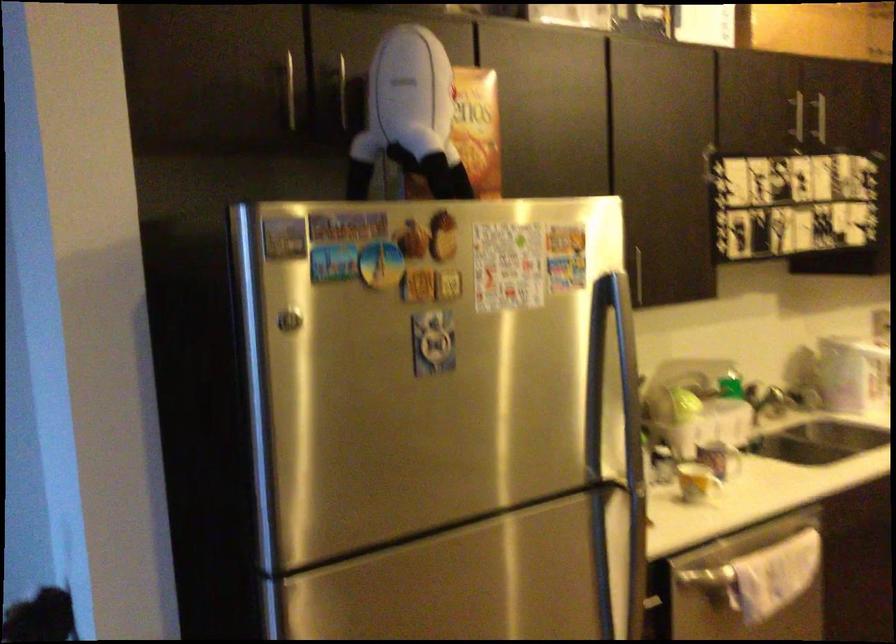
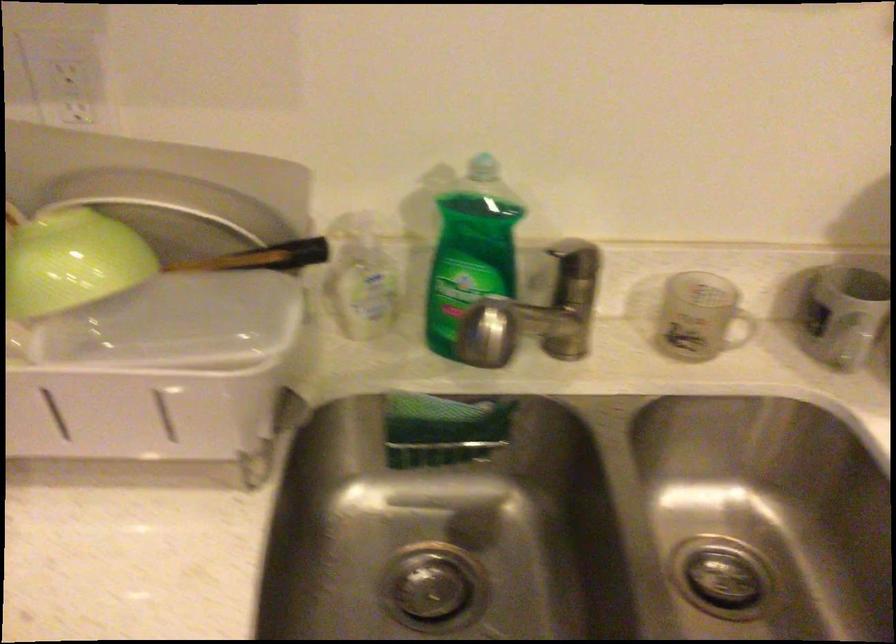
Where in the second image is the point corresponding to (755,398) from the first image?

(572, 306)